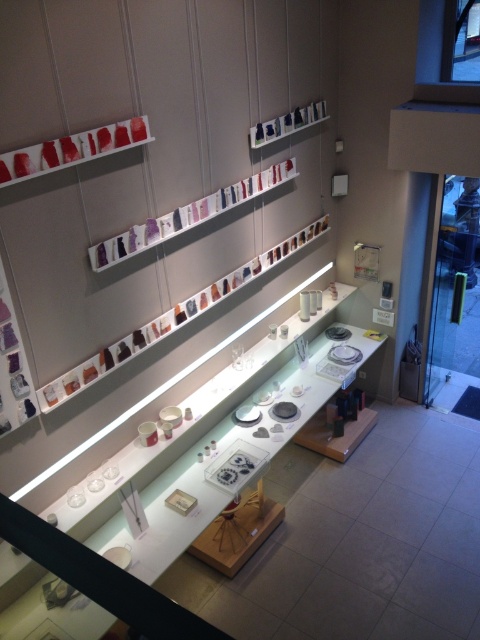
You are an interior designer arranging items on a shelf. You have the matte glass jewelry at center and the matte red glassware at upper left. Which object requires more horizontal space to display properly?

The matte glass jewelry at center requires more horizontal space to display properly since its width surpasses that of the matte red glassware at upper left.

You are an interior designer analyzing the layout of the display shelf in the gallery. The display shelf has a coordinate system where the bottom left corner is the origin point. The coordinates are given as a percentage of the shelf width and height. You need to place a new item at the center of the shelf. Where should you place it in relation to the purple glassware at upper center?

The purple glassware at upper center is located at coordinates approximately 34.00 percent in the x direction and 39.00 percent in the y direction. To place an item at the center of the shelf, you should position it at the center coordinates, which would be at 50.00 percent in both x and y directions. Therefore, the new item should be placed approximately 16.00 percent to the right and 11.00 percent downward from the purple glassware at upper center to reach the center of the shelf.